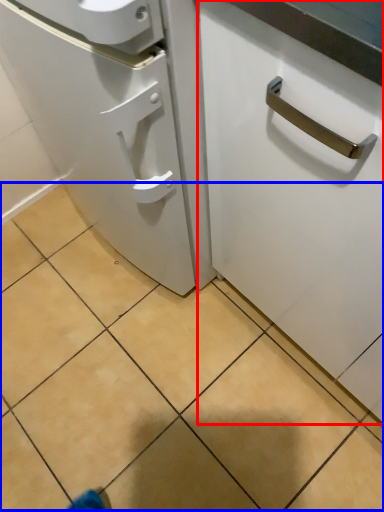
Question: Among these objects, which one is nearest to the camera, cabinetry (highlighted by a red box) or tile (highlighted by a blue box)?

Choices:
 (A) cabinetry
 (B) tile

Answer: (A)